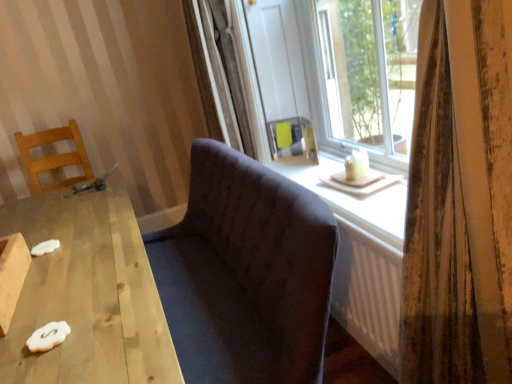
Question: Does matte glass window at center have a larger size compared to wooden table at lower left?

Choices:
 (A) no
 (B) yes

Answer: (A)

Question: Can you confirm if matte glass window at center is wider than wooden table at lower left?

Choices:
 (A) no
 (B) yes

Answer: (A)

Question: Considering the relative positions of matte glass window at center and wooden table at lower left in the image provided, is matte glass window at center to the left of wooden table at lower left from the viewer's perspective?

Choices:
 (A) no
 (B) yes

Answer: (A)

Question: Is matte glass window at center looking in the opposite direction of wooden table at lower left?

Choices:
 (A) no
 (B) yes

Answer: (A)

Question: Considering the relative sizes of matte glass window at center and wooden table at lower left in the image provided, is matte glass window at center taller than wooden table at lower left?

Choices:
 (A) yes
 (B) no

Answer: (B)

Question: Looking at their shapes, would you say matte glass window at center is wider or thinner than striped fabric curtain at right?

Choices:
 (A) thin
 (B) wide

Answer: (B)

Question: In the image, is matte glass window at center on the left side or the right side of striped fabric curtain at right?

Choices:
 (A) right
 (B) left

Answer: (A)

Question: Is matte glass window at center in front of or behind striped fabric curtain at right in the image?

Choices:
 (A) front
 (B) behind

Answer: (B)

Question: From a real-world perspective, is matte glass window at center positioned above or below striped fabric curtain at right?

Choices:
 (A) above
 (B) below

Answer: (A)

Question: Based on their sizes in the image, would you say dark fabric couch at center is bigger or smaller than wooden chair at left?

Choices:
 (A) small
 (B) big

Answer: (B)

Question: Is dark fabric couch at center spatially inside wooden chair at left, or outside of it?

Choices:
 (A) inside
 (B) outside

Answer: (B)

Question: From a real-world perspective, is dark fabric couch at center physically located above or below wooden chair at left?

Choices:
 (A) below
 (B) above

Answer: (A)

Question: Relative to wooden chair at left, is dark fabric couch at center in front or behind?

Choices:
 (A) front
 (B) behind

Answer: (A)

Question: Is dark fabric couch at center taller or shorter than wooden table at lower left?

Choices:
 (A) short
 (B) tall

Answer: (B)

Question: Is point (315, 278) closer or farther from the camera than point (128, 324)?

Choices:
 (A) farther
 (B) closer

Answer: (B)